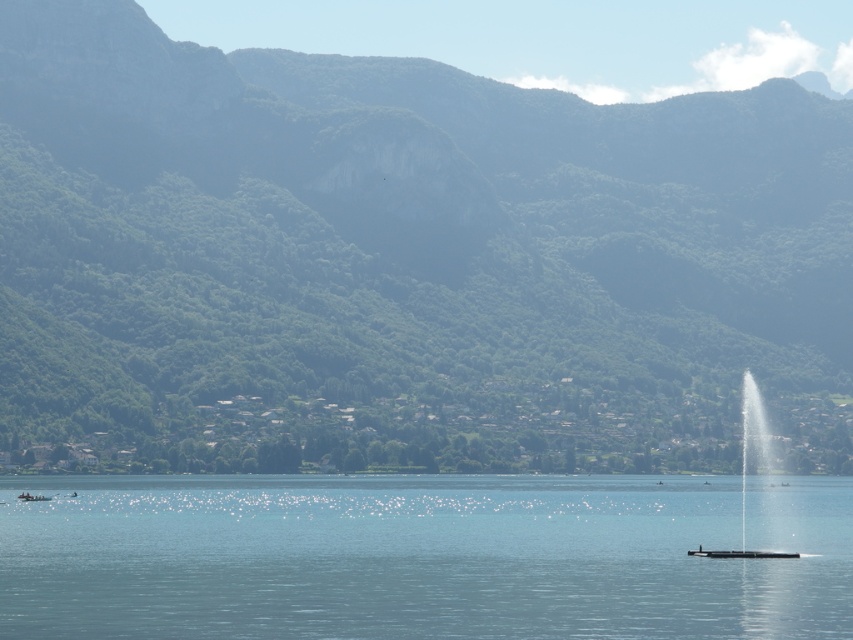
You are standing at the lakeside and want to take a photo of both point [277,330] and point [36,499] in the scene. Which point will appear larger in your photo?

Point [277,330] will appear larger in the photo because it is closer to the camera than point [36,499].

Consider the image. You are a hiker planning to traverse from the green forested mountain at center to the clear glass fountain at center. Given that your average walking pace is 5 kilometers per hour, how long would it take you to reach the fountain from the mountain?

The distance between the green forested mountain at center and the clear glass fountain at center is 107.60 meters. Converting this to kilometers, it becomes 0.1076 kilometers. Dividing this distance by your walking speed of 5 km per hour gives 0.0215 hours. Multiplying this by 60 minutes yields approximately 1.29 minutes, so it would take roughly 1.3 minutes to reach the fountain.